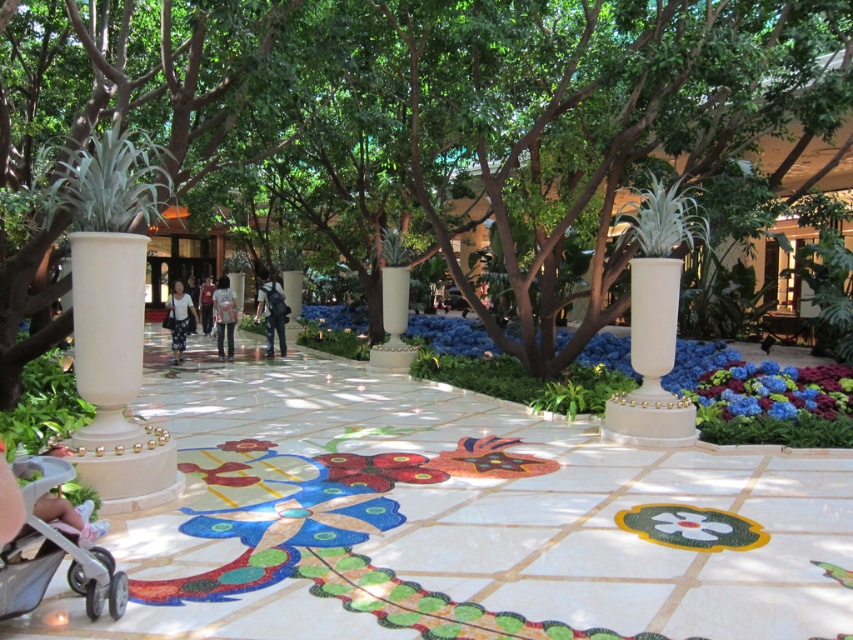
Question: Can you confirm if green leafy tree at center is positioned to the left of white cotton dress at center?

Choices:
 (A) yes
 (B) no

Answer: (B)

Question: Which point is closer to the camera?

Choices:
 (A) dark blue jeans at center
 (B) silver metallic stroller at lower left
 (C) green leafy tree at center

Answer: (B)

Question: Can you confirm if blue velvet flowers at center right is positioned below light pink fabric shirt at center?

Choices:
 (A) yes
 (B) no

Answer: (A)

Question: Which object is closer to the camera taking this photo?

Choices:
 (A) white cotton dress at center
 (B) green leafy tree at center
 (C) light pink fabric shirt at center

Answer: (B)

Question: Which of the following is the farthest from the observer?

Choices:
 (A) (415, 148)
 (B) (265, 304)

Answer: (B)

Question: Is blue velvet flowers at center right below dark blue jeans at center?

Choices:
 (A) no
 (B) yes

Answer: (B)